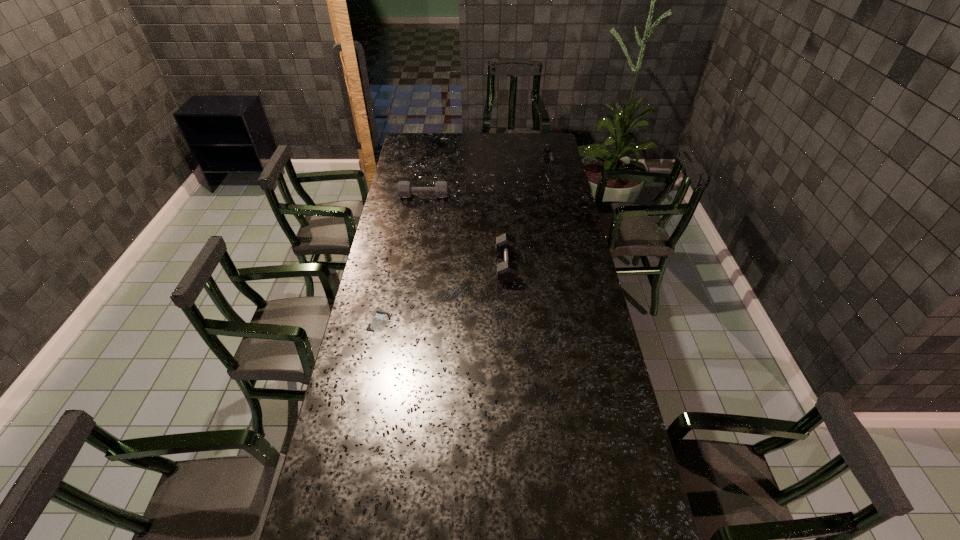
In order to click on vacant area that lies between the leftmost dumbbell and the third farthest object in this screenshot , I will do pos(465,231).

At what (x,y) coordinates should I click in order to perform the action: click on free spot between the third farthest object and the farthest object. Please return your answer as a coordinate pair (x, y). Looking at the image, I should click on (529, 219).

The image size is (960, 540). Find the location of `empty location between the third tallest object and the shortest object`. empty location between the third tallest object and the shortest object is located at coordinates (401, 259).

The height and width of the screenshot is (540, 960). Identify the location of unoccupied position between the shortest object and the shortest dumbbell. (401, 259).

The image size is (960, 540). What are the coordinates of `free space between the identity card and the farthest object` in the screenshot? It's located at (466, 246).

The image size is (960, 540). Find the location of `free space that is in between the shortest dumbbell and the identity card`. free space that is in between the shortest dumbbell and the identity card is located at coordinates (401, 259).

At what (x,y) coordinates should I click in order to perform the action: click on free area in between the second nearest dumbbell and the farthest object. Please return your answer as a coordinate pair (x, y). The height and width of the screenshot is (540, 960). Looking at the image, I should click on coord(488,184).

The width and height of the screenshot is (960, 540). I want to click on vacant point located between the second farthest dumbbell and the farthest object, so click(x=488, y=184).

Locate an element on the screen. The width and height of the screenshot is (960, 540). free space between the second dumbbell from left to right and the farthest object is located at coordinates (529, 219).

In order to click on vacant space that is in between the shortest object and the shortest dumbbell in this screenshot , I will do `click(401, 259)`.